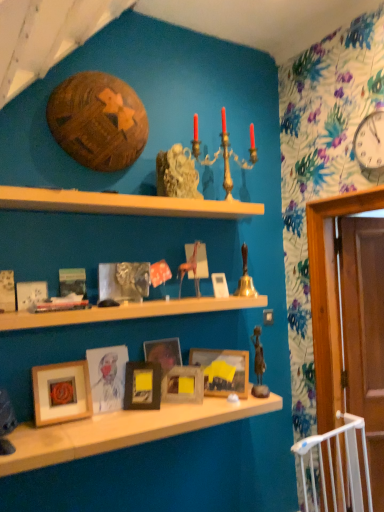
Locate an element on the screen. vacant region in front of matte wooden picture frame at center, positioned as the 3th picture frame in left-to-right order is located at coordinates (114, 429).